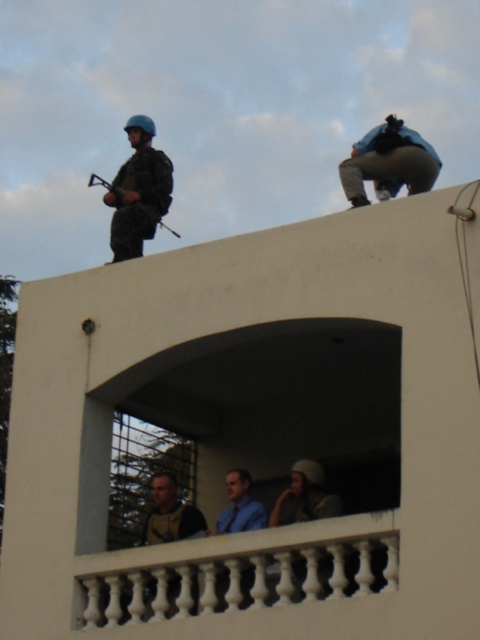
Question: Which point appears farthest from the camera in this image?

Choices:
 (A) (419, 147)
 (B) (120, 195)

Answer: (B)

Question: Among these objects, which one is farthest from the camera?

Choices:
 (A) metallic gun at upper left
 (B) matte black helmet at upper left

Answer: (A)

Question: Where is matte black helmet at upper left located in relation to blue fabric camera at upper center in the image?

Choices:
 (A) below
 (B) above

Answer: (A)

Question: Which point appears closest to the camera in this image?

Choices:
 (A) (347, 172)
 (B) (116, 189)

Answer: (A)

Question: Is white concrete balcony at upper center above matte black helmet at upper left?

Choices:
 (A) no
 (B) yes

Answer: (A)

Question: Is white concrete balcony at upper center thinner than metallic gun at upper left?

Choices:
 (A) yes
 (B) no

Answer: (B)